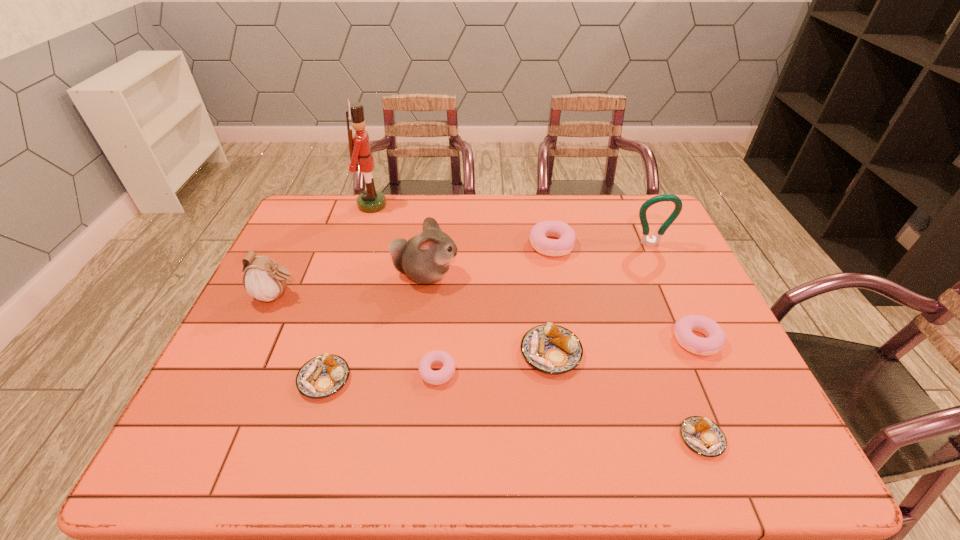
You are a GUI agent. You are given a task and a screenshot of the screen. Output one action in this format:
    pyautogui.click(x=<x>, y=<y>)
    Task: Click on the leftmost brown pastry
    
    Given the screenshot: What is the action you would take?
    pyautogui.click(x=324, y=375)

The width and height of the screenshot is (960, 540). In order to click on the second smallest brown pastry in this screenshot , I will do `click(324, 375)`.

Locate an element on the screen. the smallest pink pastry is located at coordinates (439, 377).

Locate an element on the screen. The image size is (960, 540). the leftmost pink pastry is located at coordinates [439, 377].

This screenshot has width=960, height=540. What are the coordinates of `the nearest object` in the screenshot? It's located at (703, 436).

At what (x,y) coordinates should I click in order to perform the action: click on the smallest brown pastry. Please return your answer as a coordinate pair (x, y). The width and height of the screenshot is (960, 540). Looking at the image, I should click on (703, 436).

Identify the location of vacant point located on the front-facing side of the nutcracker. (435, 205).

Where is `vacant space located at the jaws of the green bottle opener`? The width and height of the screenshot is (960, 540). vacant space located at the jaws of the green bottle opener is located at coordinates (663, 273).

Locate an element on the screen. free space located on the face of the white hamster is located at coordinates (520, 274).

Image resolution: width=960 pixels, height=540 pixels. I want to click on vacant space situated on the front-facing side of the white pouch, so click(x=361, y=295).